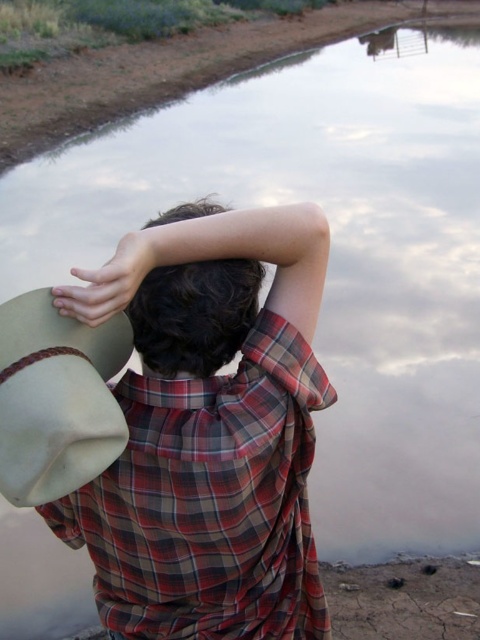
Does point (250, 576) lie in front of point (109, 307)?

No, it is not.

Locate an element on the screen. This screenshot has width=480, height=640. plaid cotton shirt at back is located at coordinates [210, 500].

Locate an element on the screen. This screenshot has width=480, height=640. plaid cotton shirt at back is located at coordinates (210, 500).

Does plaid cotton shirt at back have a larger size compared to beige felt hat at upper left?

Yes.

Between point (252, 392) and point (87, 346), which one is positioned in front?

Point (87, 346)

Identify the location of plaid cotton shirt at back. The width and height of the screenshot is (480, 640). (210, 500).

Measure the distance between point [305,422] and camera.

They are 3.44 feet apart.

Between point (79, 508) and point (250, 291), which one is positioned behind?

The point (79, 508) is more distant.

I want to click on plaid cotton shirt at back, so click(x=210, y=500).